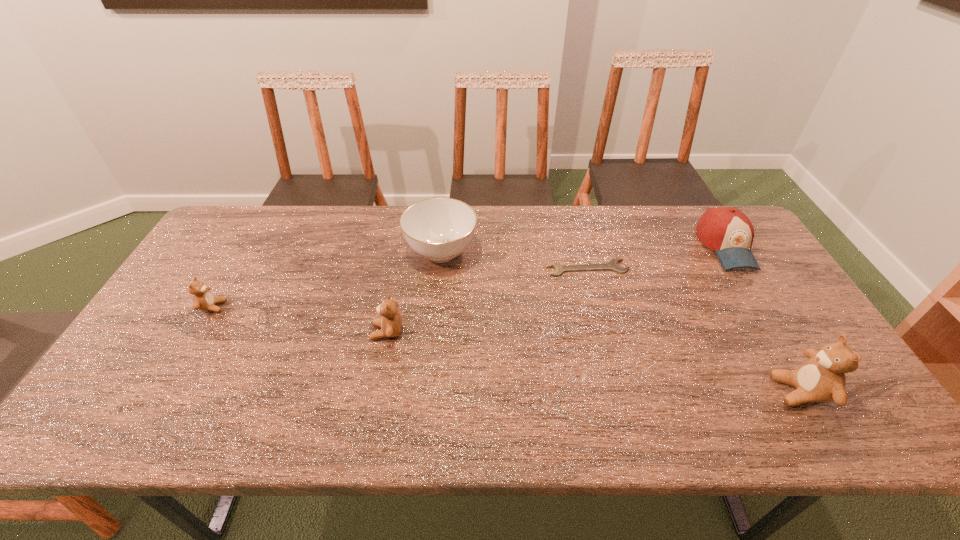
The image size is (960, 540). What are the coordinates of `free space between the second teddy bear from right to left and the shortest teddy bear` in the screenshot? It's located at (300, 319).

Locate an element on the screen. vacant point located between the nearest teddy bear and the chinaware is located at coordinates (620, 321).

This screenshot has height=540, width=960. I want to click on the third closest object to the second teddy bear from right to left, so click(x=613, y=265).

Identify which object is the second nearest to the second teddy bear from left to right. Please provide its 2D coordinates. Your answer should be formatted as a tuple, i.e. [(x, y)], where the tuple contains the x and y coordinates of a point satisfying the conditions above.

[(203, 299)]

Identify which teddy bear is the second closest to the rightmost teddy bear. Please provide its 2D coordinates. Your answer should be formatted as a tuple, i.e. [(x, y)], where the tuple contains the x and y coordinates of a point satisfying the conditions above.

[(203, 299)]

Identify the location of the second closest teddy bear to the shortest object. (391, 322).

Locate an element on the screen. Image resolution: width=960 pixels, height=540 pixels. vacant space that satisfies the following two spatial constraints: 1. on the front-facing side of the baseball cap; 2. on the front-facing side of the leftmost object is located at coordinates (763, 307).

This screenshot has width=960, height=540. What are the coordinates of `free space that satisfies the following two spatial constraints: 1. on the front-facing side of the baseball cap; 2. on the front-facing side of the second teddy bear from left to right` in the screenshot? It's located at (779, 332).